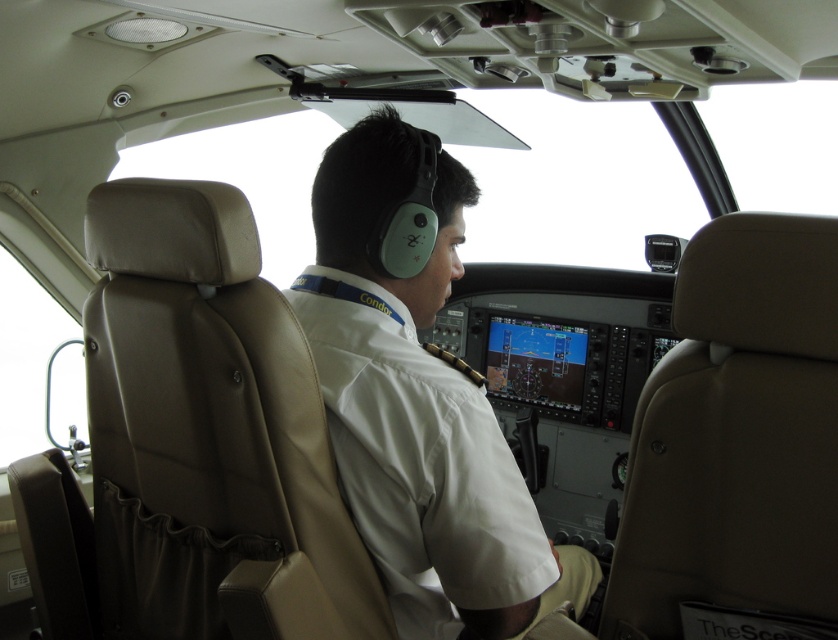
Question: Is leather seat at left positioned at the back of white fabric pilot at center?

Choices:
 (A) no
 (B) yes

Answer: (A)

Question: Can you confirm if leather seat at left is positioned above white fabric pilot at center?

Choices:
 (A) yes
 (B) no

Answer: (B)

Question: Can you confirm if leather seat at left is wider than white fabric pilot at center?

Choices:
 (A) yes
 (B) no

Answer: (A)